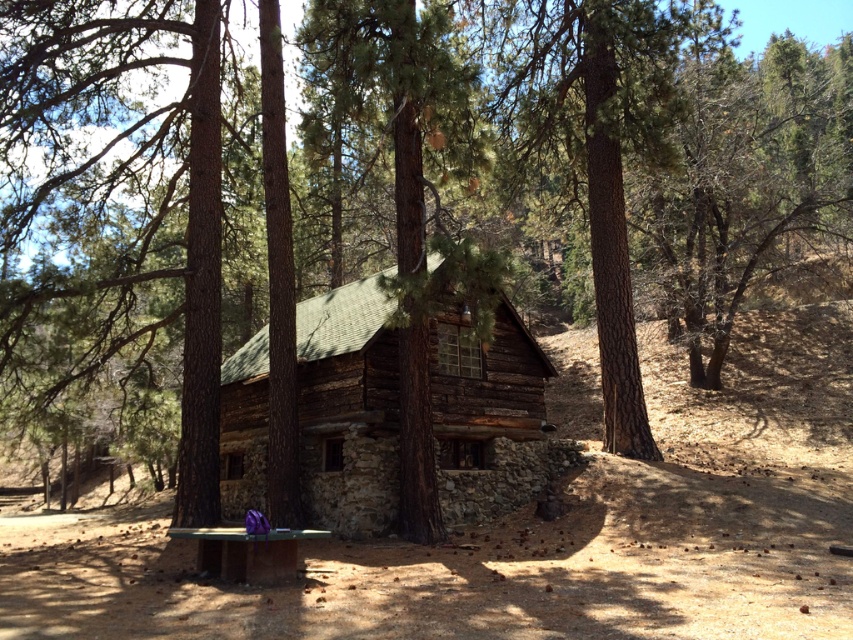
You are standing in front of the rustic log cabin and want to place a small flowerpot between the two points marked as point [518,412] and point [204,531]. Which point should the flowerpot be closer to in order to be nearer to the camera?

The flowerpot should be closer to point [518,412] because it is further to the camera than point [204,531].

Looking at this image, you are standing at the point marked as point (347, 408). What structure can you see directly in front of you?

The weathered wood cabin at center is located at point (347, 408), so the structure directly in front of you is the weathered wood cabin at center.